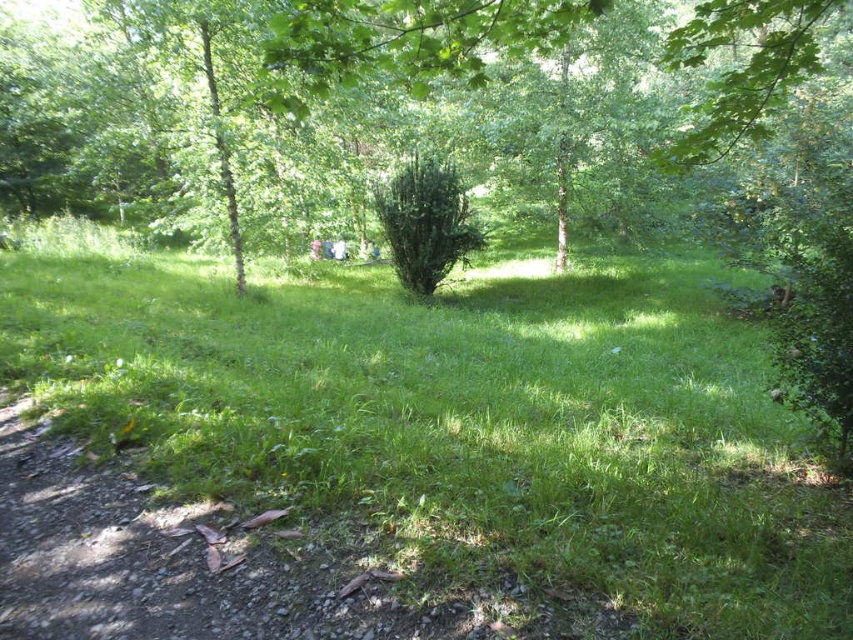
Question: Is green grassy at center bigger than green leafy bush at center?

Choices:
 (A) no
 (B) yes

Answer: (A)

Question: Is green grassy at center below green leafy bush at center?

Choices:
 (A) no
 (B) yes

Answer: (B)

Question: Which point is closer to the camera taking this photo?

Choices:
 (A) (679, 470)
 (B) (56, 84)

Answer: (A)

Question: Can you confirm if green grassy at center is smaller than green leafy bush at center?

Choices:
 (A) yes
 (B) no

Answer: (A)